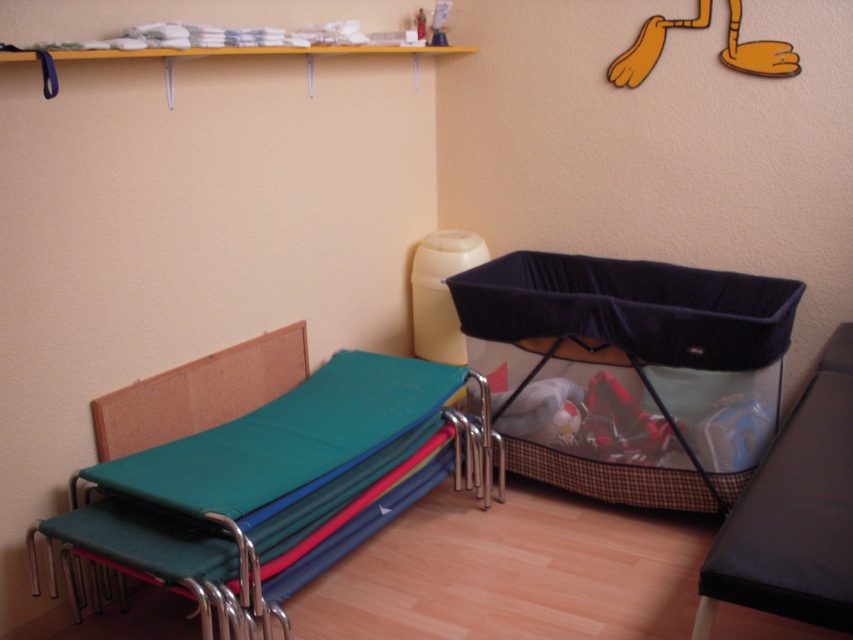
Can you confirm if teal fabric chair at lower left is shorter than black fabric chair at lower right?

Indeed, teal fabric chair at lower left has a lesser height compared to black fabric chair at lower right.

Does point (252, 424) come closer to viewer compared to point (752, 544)?

No.

Locate an element on the screen. This screenshot has height=640, width=853. teal fabric chair at lower left is located at coordinates (271, 481).

Is velvet black crib at center closer to the viewer compared to teal fabric chair at lower left?

No.

From the picture: Who is shorter, velvet black crib at center or teal fabric chair at lower left?

With less height is teal fabric chair at lower left.

Who is more distant from viewer, (648, 324) or (329, 422)?

The point (648, 324) is more distant.

This screenshot has width=853, height=640. Find the location of `velvet black crib at center`. velvet black crib at center is located at coordinates click(630, 371).

Does velvet black crib at center have a larger size compared to black fabric chair at lower right?

Correct, velvet black crib at center is larger in size than black fabric chair at lower right.

Measure the distance between velvet black crib at center and black fabric chair at lower right.

velvet black crib at center and black fabric chair at lower right are 22.93 inches apart from each other.

This screenshot has width=853, height=640. In order to click on velvet black crib at center in this screenshot , I will do `click(630, 371)`.